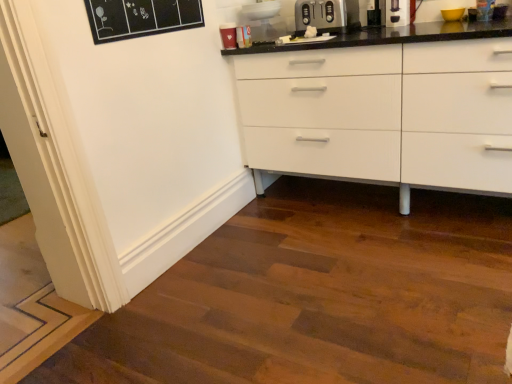
Question: Is the depth of black plastic coffee machine at upper right greater than that of satin silver toaster at upper center?

Choices:
 (A) no
 (B) yes

Answer: (A)

Question: Considering the relative sizes of black plastic coffee machine at upper right and satin silver toaster at upper center in the image provided, is black plastic coffee machine at upper right smaller than satin silver toaster at upper center?

Choices:
 (A) yes
 (B) no

Answer: (A)

Question: Does black plastic coffee machine at upper right come in front of satin silver toaster at upper center?

Choices:
 (A) no
 (B) yes

Answer: (B)

Question: Does black plastic coffee machine at upper right appear on the left side of satin silver toaster at upper center?

Choices:
 (A) no
 (B) yes

Answer: (A)

Question: From a real-world perspective, is black plastic coffee machine at upper right positioned over satin silver toaster at upper center based on gravity?

Choices:
 (A) no
 (B) yes

Answer: (B)

Question: From a real-world perspective, is black plastic coffee machine at upper right below satin silver toaster at upper center?

Choices:
 (A) yes
 (B) no

Answer: (B)

Question: Is satin silver toaster at upper center wider than black plastic coffee machine at upper right?

Choices:
 (A) no
 (B) yes

Answer: (B)

Question: Can you see satin silver toaster at upper center touching black plastic coffee machine at upper right?

Choices:
 (A) no
 (B) yes

Answer: (A)

Question: Considering the relative sizes of satin silver toaster at upper center and black plastic coffee machine at upper right in the image provided, is satin silver toaster at upper center bigger than black plastic coffee machine at upper right?

Choices:
 (A) no
 (B) yes

Answer: (B)

Question: Is satin silver toaster at upper center positioned in front of black plastic coffee machine at upper right?

Choices:
 (A) yes
 (B) no

Answer: (B)

Question: From the image's perspective, is satin silver toaster at upper center below black plastic coffee machine at upper right?

Choices:
 (A) no
 (B) yes

Answer: (B)

Question: From a real-world perspective, does satin silver toaster at upper center sit lower than black plastic coffee machine at upper right?

Choices:
 (A) no
 (B) yes

Answer: (B)

Question: Is black plastic coffee machine at upper right wider or thinner than satin silver toaster at upper center?

Choices:
 (A) thin
 (B) wide

Answer: (A)